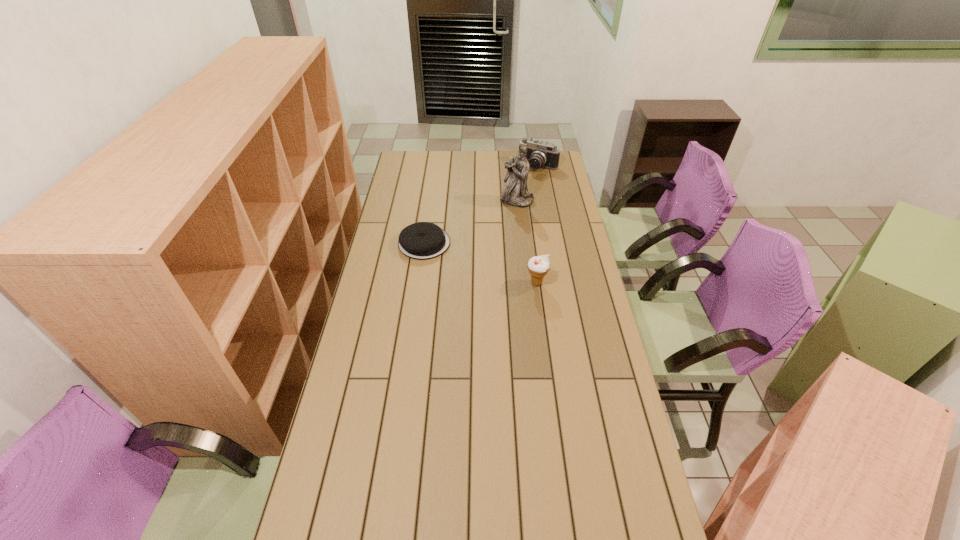
Image resolution: width=960 pixels, height=540 pixels. Find the location of `free point between the farthest object and the figurine`. free point between the farthest object and the figurine is located at coordinates (528, 184).

Find the location of `unoccupied position between the pancake and the figurine`. unoccupied position between the pancake and the figurine is located at coordinates click(470, 222).

You are a GUI agent. You are given a task and a screenshot of the screen. Output one action in this format:
    pyautogui.click(x=<x>, y=<y>)
    Task: Click on the free space between the leftmost object and the icecream
    Image resolution: width=960 pixels, height=540 pixels.
    Given the screenshot: What is the action you would take?
    pyautogui.click(x=480, y=263)

This screenshot has width=960, height=540. I want to click on free spot between the second farthest object and the nearest object, so click(x=527, y=242).

This screenshot has height=540, width=960. I want to click on object that is the second closest to the icecream, so click(x=514, y=193).

Image resolution: width=960 pixels, height=540 pixels. In order to click on the third closest object to the camera in this screenshot , I will do `click(538, 266)`.

Locate an element on the screen. free space that satisfies the following two spatial constraints: 1. on the back side of the camera; 2. on the left side of the shortest object is located at coordinates (435, 167).

Identify the location of vacant space that satisfies the following two spatial constraints: 1. on the back side of the second nearest object; 2. on the left side of the farthest object. The image size is (960, 540). (435, 167).

This screenshot has height=540, width=960. What are the coordinates of `vacant space that satisfies the following two spatial constraints: 1. on the back side of the farthest object; 2. on the left side of the pancake` in the screenshot? It's located at (435, 167).

I want to click on blank space that satisfies the following two spatial constraints: 1. on the front side of the nearest object; 2. on the right side of the second farthest object, so click(526, 283).